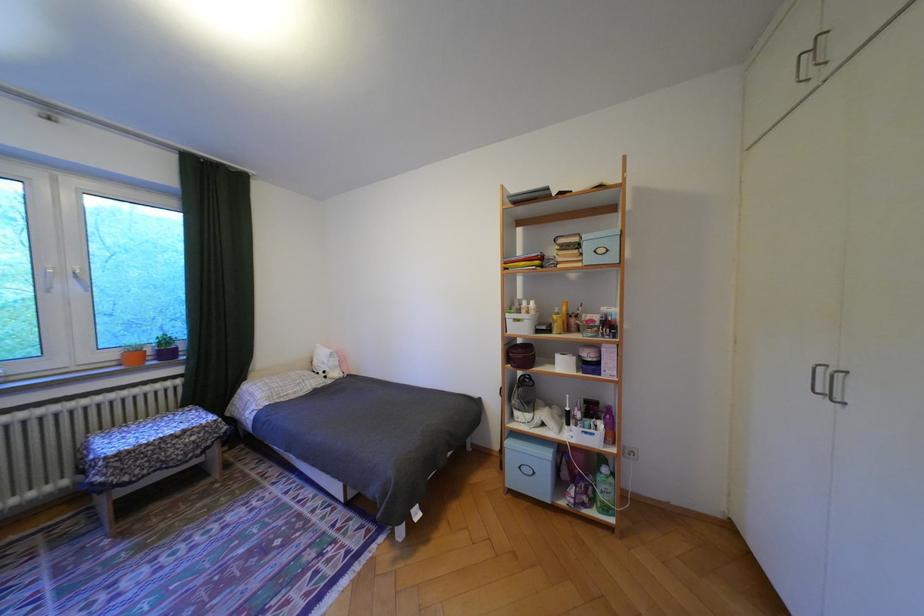
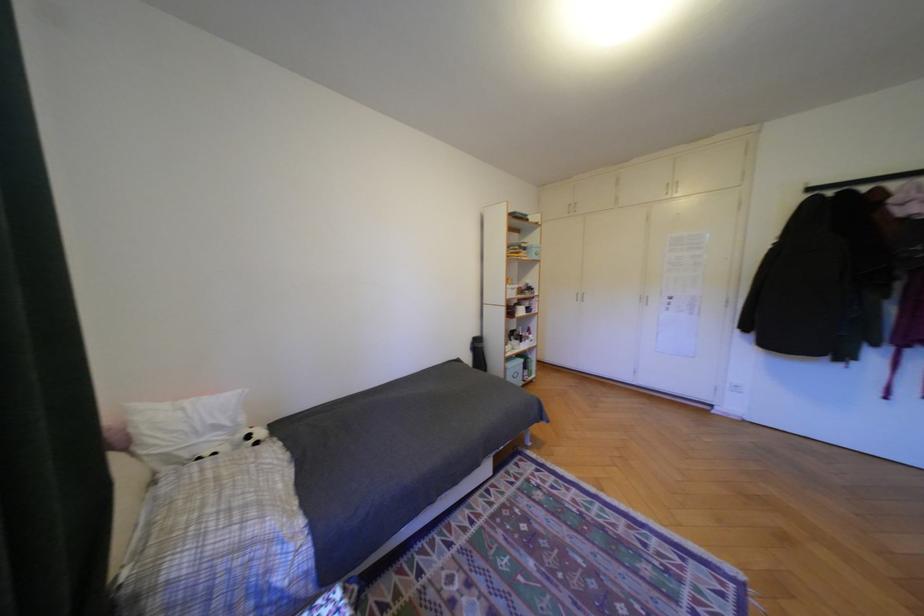
Where in the second image is the point corresponding to (x=335, y=371) from the first image?

(261, 437)